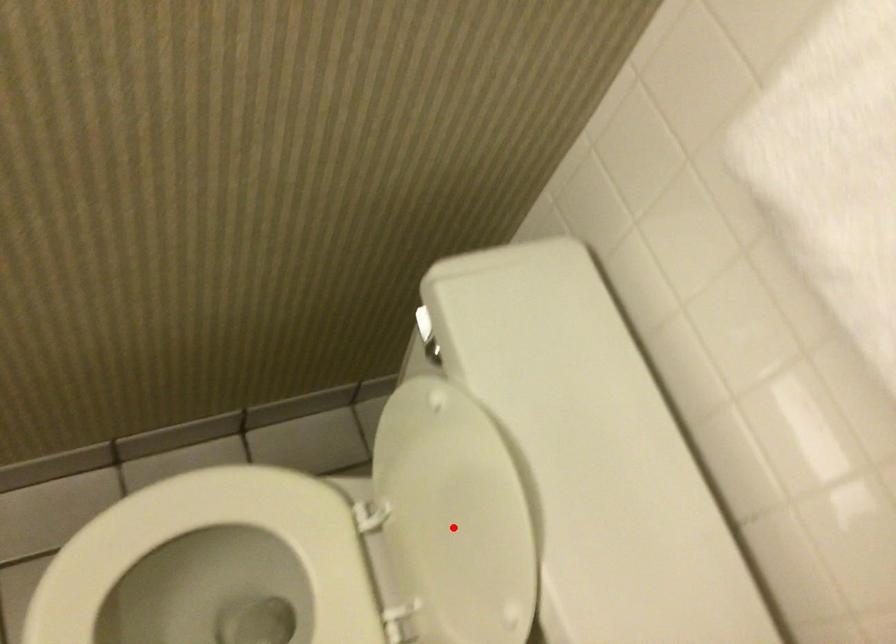
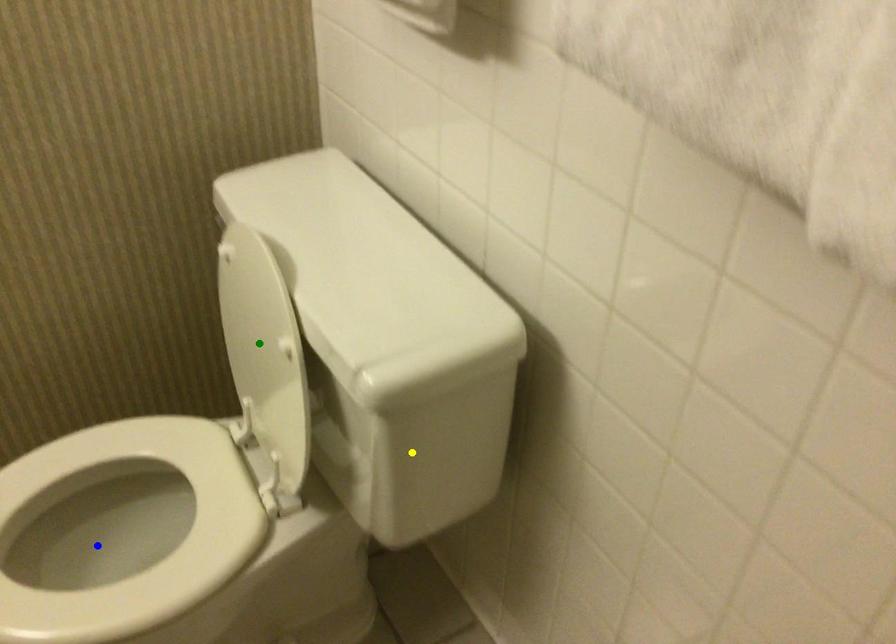
Question: I am providing you with two images of the same scene from different viewpoints. A red point is marked on the first image. You are given multiple points on the second image. In image 2, which mark is for the same physical point as the one in image 1?

Choices:
 (A) green point
 (B) blue point
 (C) yellow point

Answer: (A)